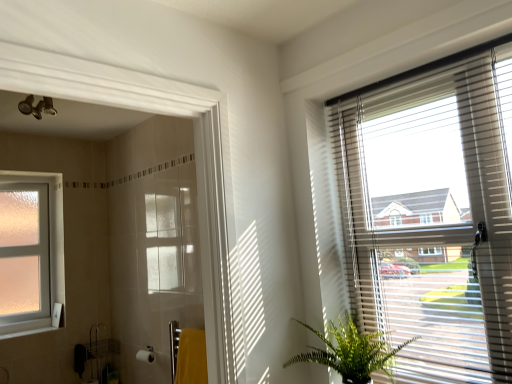
What do you see at coordinates (432, 213) in the screenshot? I see `matte gray blinds at upper right` at bounding box center [432, 213].

The height and width of the screenshot is (384, 512). What are the coordinates of `yellow fabric towel at lower center` in the screenshot? It's located at (191, 357).

From a real-world perspective, who is located lower, yellow fabric towel at lower center or frosted glass window at left?

yellow fabric towel at lower center.

Is yellow fabric towel at lower center behind frosted glass window at left?

No, it is in front of frosted glass window at left.

From the image's perspective, which one is positioned higher, yellow fabric towel at lower center or frosted glass window at left?

frosted glass window at left is shown above in the image.

Does point (352, 94) come behind point (55, 262)?

That is False.

Is frosted glass window at left at the back of matte gray blinds at upper right?

matte gray blinds at upper right does not have its back to frosted glass window at left.

Considering the relative sizes of matte gray blinds at upper right and frosted glass window at left in the image provided, is matte gray blinds at upper right wider than frosted glass window at left?

No.

Considering the sizes of objects matte gray blinds at upper right and frosted glass window at left in the image provided, who is bigger, matte gray blinds at upper right or frosted glass window at left?

With larger size is matte gray blinds at upper right.

Does frosted glass window at left have a larger size compared to white plastic window sill at lower left?

Yes, frosted glass window at left is bigger than white plastic window sill at lower left.

Which object is closer to the camera, frosted glass window at left or white plastic window sill at lower left?

white plastic window sill at lower left is in front.

Can you confirm if frosted glass window at left is wider than white plastic window sill at lower left?

Incorrect, the width of frosted glass window at left does not surpass that of white plastic window sill at lower left.

Considering the sizes of objects frosted glass window at left and matte gray blinds at upper right in the image provided, who is smaller, frosted glass window at left or matte gray blinds at upper right?

With smaller size is frosted glass window at left.

Could you tell me if frosted glass window at left is facing matte gray blinds at upper right?

Yes, frosted glass window at left is oriented towards matte gray blinds at upper right.

Based on the photo, measure the distance from frosted glass window at left to matte gray blinds at upper right.

The distance of frosted glass window at left from matte gray blinds at upper right is 7.29 feet.

Does point (40, 180) appear closer or farther from the camera than point (500, 282)?

Clearly, point (40, 180) is more distant from the camera than point (500, 282).

Is point (13, 334) positioned before point (332, 354)?

No, (13, 334) is behind (332, 354).

Is white plastic window sill at lower left taller or shorter than green leafy plant at lower right?

Clearly, white plastic window sill at lower left is shorter compared to green leafy plant at lower right.

Does white plastic window sill at lower left turn towards green leafy plant at lower right?

Yes.

Who is more distant, white plastic window sill at lower left or green leafy plant at lower right?

white plastic window sill at lower left is further from the camera.

Is white glossy shower door at left to the left of matte gray blinds at upper right from the viewer's perspective?

Indeed, white glossy shower door at left is positioned on the left side of matte gray blinds at upper right.

Based on their sizes in the image, would you say white glossy shower door at left is bigger or smaller than matte gray blinds at upper right?

Considering their sizes, white glossy shower door at left takes up more space than matte gray blinds at upper right.

From the image's perspective, is white glossy shower door at left located above or below matte gray blinds at upper right?

From the image's perspective, white glossy shower door at left appears above matte gray blinds at upper right.

Which is more to the left, frosted glass window at left or green leafy plant at lower right?

Positioned to the left is frosted glass window at left.

How much distance is there between frosted glass window at left and green leafy plant at lower right?

They are 6.73 feet apart.

Can you tell me how much frosted glass window at left and green leafy plant at lower right differ in facing direction?

The angle between the facing direction of frosted glass window at left and the facing direction of green leafy plant at lower right is 89.9 degrees.

From a real-world perspective, is frosted glass window at left physically located above or below green leafy plant at lower right?

frosted glass window at left is situated higher than green leafy plant at lower right in the real world.

Locate an element on the screen. This screenshot has width=512, height=384. window above the yellow fabric towel at lower center (from the image's perspective) is located at coordinates (31, 253).

Find the location of a particular element. The image size is (512, 384). window lying on the left of matte gray blinds at upper right is located at coordinates (31, 253).

Based on their spatial positions, is green leafy plant at lower right or white glossy shower door at left further from white plastic window sill at lower left?

green leafy plant at lower right lies further to white plastic window sill at lower left than the other object.

Looking at the image, which one is located further to white glossy shower door at left, green leafy plant at lower right or yellow fabric towel at lower center?

The object further to white glossy shower door at left is yellow fabric towel at lower center.

Looking at this image, from the image, which object appears to be farther from frosted glass window at left, yellow fabric towel at lower center or white plastic window sill at lower left?

yellow fabric towel at lower center is positioned further to the anchor frosted glass window at left.

Looking at the image, which one is located closer to white plastic window sill at lower left, yellow fabric towel at lower center or matte gray blinds at upper right?

The object closer to white plastic window sill at lower left is yellow fabric towel at lower center.

Estimate the real-world distances between objects in this image. Which object is closer to white plastic window sill at lower left, yellow fabric towel at lower center or green leafy plant at lower right?

yellow fabric towel at lower center is closer to white plastic window sill at lower left.

Based on their spatial positions, is green leafy plant at lower right or white glossy shower door at left closer to matte gray blinds at upper right?

The object closer to matte gray blinds at upper right is green leafy plant at lower right.

Which object lies nearer to the anchor point matte gray blinds at upper right, white plastic window sill at lower left or yellow fabric towel at lower center?

yellow fabric towel at lower center is positioned closer to the anchor matte gray blinds at upper right.

Which object lies further to the anchor point white glossy shower door at left, green leafy plant at lower right or white plastic window sill at lower left?

white plastic window sill at lower left is further to white glossy shower door at left.

In order to click on bath towel situated between white plastic window sill at lower left and green leafy plant at lower right from left to right in this screenshot , I will do `click(191, 357)`.

You are a GUI agent. You are given a task and a screenshot of the screen. Output one action in this format:
    pyautogui.click(x=<x>, y=<y>)
    Task: Click on the screen door situated between white plastic window sill at lower left and matte gray blinds at upper right from left to right
    This screenshot has width=512, height=384.
    Given the screenshot: What is the action you would take?
    pyautogui.click(x=121, y=98)

Identify the location of bath towel between frosted glass window at left and green leafy plant at lower right in the horizontal direction. The image size is (512, 384). (191, 357).

Image resolution: width=512 pixels, height=384 pixels. In order to click on bath towel between white glossy shower door at left and matte gray blinds at upper right from left to right in this screenshot , I will do `click(191, 357)`.